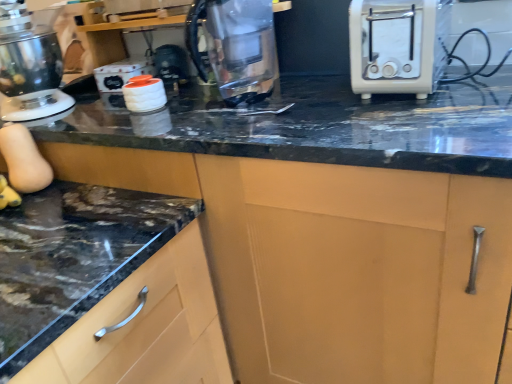
Question: Would you consider transparent glass kettle at center to be distant from white glossy canisters at upper center?

Choices:
 (A) no
 (B) yes

Answer: (A)

Question: From the image's perspective, is transparent glass kettle at center under white glossy canisters at upper center?

Choices:
 (A) yes
 (B) no

Answer: (A)

Question: Does transparent glass kettle at center have a lesser width compared to white glossy canisters at upper center?

Choices:
 (A) no
 (B) yes

Answer: (B)

Question: Is white glossy canisters at upper center inside transparent glass kettle at center?

Choices:
 (A) no
 (B) yes

Answer: (A)

Question: Is transparent glass kettle at center wider than white glossy canisters at upper center?

Choices:
 (A) yes
 (B) no

Answer: (B)

Question: From the image's perspective, is transparent glass kettle at center above or below white glossy canisters at upper center?

Choices:
 (A) above
 (B) below

Answer: (B)

Question: Considering their positions, is transparent glass kettle at center located in front of or behind white glossy canisters at upper center?

Choices:
 (A) behind
 (B) front

Answer: (B)

Question: Based on their sizes in the image, would you say transparent glass kettle at center is bigger or smaller than white glossy canisters at upper center?

Choices:
 (A) big
 (B) small

Answer: (A)

Question: Based on their positions, is transparent glass kettle at center located to the left or right of white glossy canisters at upper center?

Choices:
 (A) right
 (B) left

Answer: (A)

Question: Would you say metallic silver stand mixer at left is inside or outside white glossy canisters at upper center?

Choices:
 (A) inside
 (B) outside

Answer: (B)

Question: Considering the positions of point (12, 66) and point (109, 84), is point (12, 66) closer or farther from the camera than point (109, 84)?

Choices:
 (A) closer
 (B) farther

Answer: (A)

Question: From a real-world perspective, is metallic silver stand mixer at left above or below white glossy canisters at upper center?

Choices:
 (A) above
 (B) below

Answer: (A)

Question: Considering their positions, is metallic silver stand mixer at left located in front of or behind white glossy canisters at upper center?

Choices:
 (A) front
 (B) behind

Answer: (A)

Question: Considering the positions of white plastic toaster at right and metallic silver stand mixer at left in the image, is white plastic toaster at right wider or thinner than metallic silver stand mixer at left?

Choices:
 (A) wide
 (B) thin

Answer: (B)

Question: From the image's perspective, is white plastic toaster at right positioned above or below metallic silver stand mixer at left?

Choices:
 (A) below
 (B) above

Answer: (A)